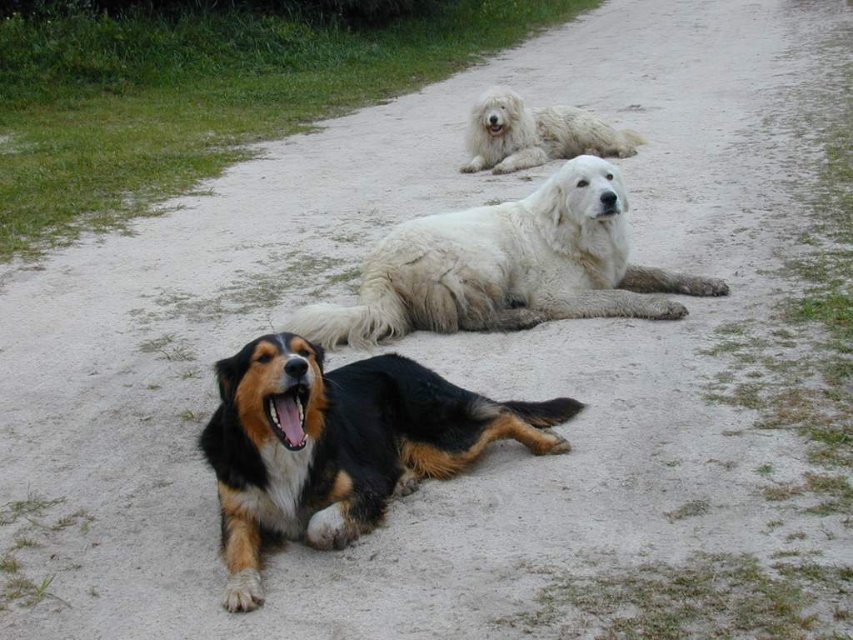
You are a photographer trying to capture a group shot of the three dogs. You notice a specific point marked at coordinates point (x=340, y=444). Which dog is located exactly at this point?

The point (x=340, y=444) indicates the tri colored fur dog at center.

You are a dog owner who wants to take a photo of both white fluffy dog at center and white fluffy dog at upper center. To ensure both are fully visible in the frame, which dog should be positioned closer to the camera?

The white fluffy dog at center is taller than the white fluffy dog at upper center, so to ensure both are fully visible, position the taller white fluffy dog at center closer to the camera to avoid it blocking the smaller one.